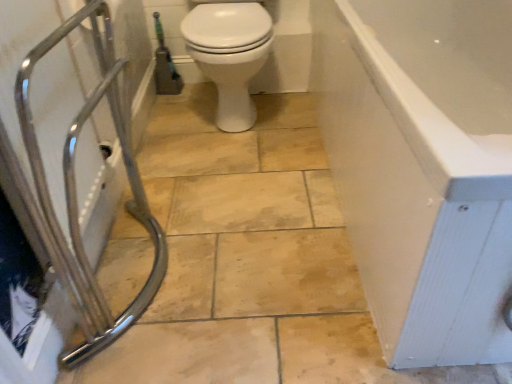
Question: Based on their sizes in the image, would you say green rubber garden hose at upper left is bigger or smaller than white glossy bathtub at right?

Choices:
 (A) big
 (B) small

Answer: (B)

Question: In the image, is green rubber garden hose at upper left positioned in front of or behind white glossy bathtub at right?

Choices:
 (A) front
 (B) behind

Answer: (B)

Question: Which is farther from the white glossy toilet at center?

Choices:
 (A) green rubber garden hose at upper left
 (B) white glossy bathtub at right
 (C) chrome metallic shower at left

Answer: (A)

Question: Which is nearer to the white glossy toilet at center?

Choices:
 (A) green rubber garden hose at upper left
 (B) chrome metallic shower at left
 (C) white glossy bathtub at right

Answer: (B)